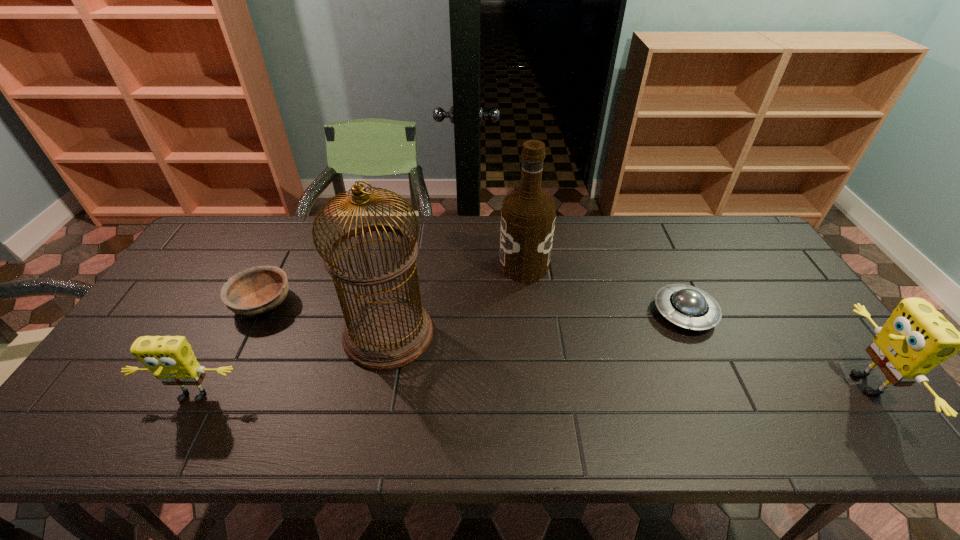
At what (x,y) coordinates should I click in order to perform the action: click on the fourth tallest object. Please return your answer as a coordinate pair (x, y). Looking at the image, I should click on (171, 359).

Where is `the shorter sponge`? the shorter sponge is located at coordinates (171, 359).

At what (x,y) coordinates should I click in order to perform the action: click on the right sponge. Please return your answer as a coordinate pair (x, y). Looking at the image, I should click on (916, 338).

Where is `the taller sponge`? the taller sponge is located at coordinates (916, 338).

Where is `the fifth object from left to right`? The image size is (960, 540). the fifth object from left to right is located at coordinates click(686, 306).

What are the coordinates of `alcohol` in the screenshot? It's located at 528,215.

What are the coordinates of `birdcage` in the screenshot? It's located at (389, 332).

At what (x,y) coordinates should I click in order to perform the action: click on bowl. Please return your answer as a coordinate pair (x, y). Image resolution: width=960 pixels, height=540 pixels. Looking at the image, I should click on (256, 290).

In order to click on vacant space located on the face of the taller sponge in this screenshot , I will do `click(816, 384)`.

At what (x,y) coordinates should I click in order to perform the action: click on free region located 0.130m on the face of the taller sponge. Please return your answer as a coordinate pair (x, y). The image size is (960, 540). Looking at the image, I should click on (791, 384).